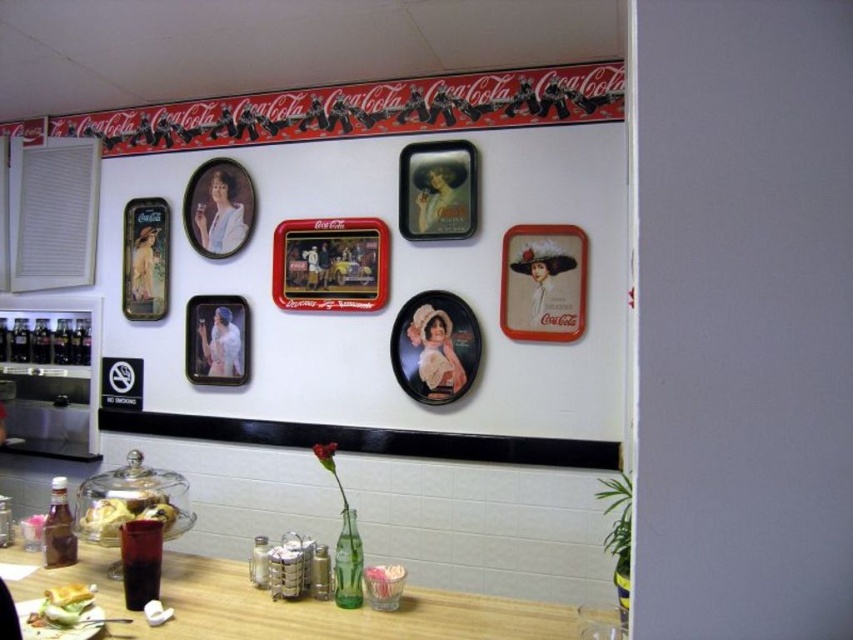
Question: Among these points, which one is farthest from the camera?

Choices:
 (A) (372, 291)
 (B) (431, 164)
 (C) (233, 180)

Answer: (C)

Question: Considering the real-world distances, which object is closest to the matte black picture frame at center?

Choices:
 (A) matte black rectangular frame at upper left
 (B) metallic silver picture frame at center

Answer: (A)

Question: Can you confirm if matte black rectangular frame at upper left is positioned to the right of translucent glass bowl at lower left?

Choices:
 (A) no
 (B) yes

Answer: (A)

Question: Is matte black picture frame at center behind matte green lettuce at lower left?

Choices:
 (A) yes
 (B) no

Answer: (A)

Question: Which point appears farthest from the camera in this image?

Choices:
 (A) (x=378, y=260)
 (B) (x=161, y=209)
 (C) (x=51, y=593)
 (D) (x=244, y=362)

Answer: (B)

Question: From the image, what is the correct spatial relationship of metallic silver picture frame at center in relation to matte green lettuce at lower left?

Choices:
 (A) above
 (B) below

Answer: (A)